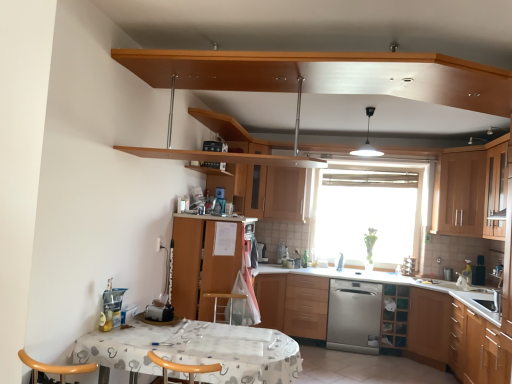
Question: Is wooden cabinet at upper center, the 1th shelf positioned from the left, taller than wooden cabinet at lower center, acting as the 3th cabinetry starting from the left?

Choices:
 (A) no
 (B) yes

Answer: (A)

Question: Is wooden cabinet at lower center, acting as the 3th cabinetry starting from the left, completely or partially inside wooden cabinet at upper center, which is the first shelf in front-to-back order?

Choices:
 (A) no
 (B) yes

Answer: (A)

Question: Can you confirm if wooden cabinet at upper center, which is the 1th shelf from top to bottom, is shorter than wooden cabinet at lower center, acting as the 3th cabinetry starting from the left?

Choices:
 (A) yes
 (B) no

Answer: (A)

Question: Considering the relative positions of wooden cabinet at upper center, which is counted as the 2th shelf, starting from the bottom, and wooden cabinet at lower center, placed as the 4th cabinetry when sorted from right to left, in the image provided, is wooden cabinet at upper center, which is counted as the 2th shelf, starting from the bottom, to the right of wooden cabinet at lower center, placed as the 4th cabinetry when sorted from right to left, from the viewer's perspective?

Choices:
 (A) no
 (B) yes

Answer: (A)

Question: Is wooden cabinet at upper center, which appears as the second shelf when viewed from the back, smaller than wooden cabinet at lower center, placed as the 4th cabinetry when sorted from right to left?

Choices:
 (A) no
 (B) yes

Answer: (B)

Question: Is white fabric-covered table at lower center to the left or to the right of wooden cabinet at lower center, placed as the 4th cabinetry when sorted from right to left, in the image?

Choices:
 (A) left
 (B) right

Answer: (A)

Question: Is white fabric-covered table at lower center spatially inside wooden cabinet at lower center, acting as the 3th cabinetry starting from the left, or outside of it?

Choices:
 (A) outside
 (B) inside

Answer: (A)

Question: From a real-world perspective, is white fabric-covered table at lower center positioned above or below wooden cabinet at lower center, placed as the 4th cabinetry when sorted from right to left?

Choices:
 (A) above
 (B) below

Answer: (A)

Question: Is point (133, 322) closer or farther from the camera than point (264, 322)?

Choices:
 (A) closer
 (B) farther

Answer: (A)

Question: In terms of size, does transparent glass window at center appear bigger or smaller than wooden cabinet at upper right, which is counted as the 6th cabinetry, starting from the left?

Choices:
 (A) big
 (B) small

Answer: (A)

Question: From a real-world perspective, relative to wooden cabinet at upper right, which is counted as the 6th cabinetry, starting from the left, is transparent glass window at center vertically above or below?

Choices:
 (A) below
 (B) above

Answer: (A)

Question: Choose the correct answer: Is transparent glass window at center inside wooden cabinet at upper right, the 1th cabinetry positioned from the right, or outside it?

Choices:
 (A) inside
 (B) outside

Answer: (B)

Question: From the image's perspective, is transparent glass window at center positioned above or below wooden cabinet at upper right, the 1th cabinetry positioned from the right?

Choices:
 (A) above
 (B) below

Answer: (B)

Question: From the image's perspective, is wooden cabinet at right, arranged as the 3th cabinetry when viewed from the right, located above or below wooden cabinet at upper center, which is the first shelf in front-to-back order?

Choices:
 (A) above
 (B) below

Answer: (B)

Question: Is wooden cabinet at right, arranged as the 3th cabinetry when viewed from the right, taller or shorter than wooden cabinet at upper center, which is the 1th shelf from top to bottom?

Choices:
 (A) short
 (B) tall

Answer: (B)